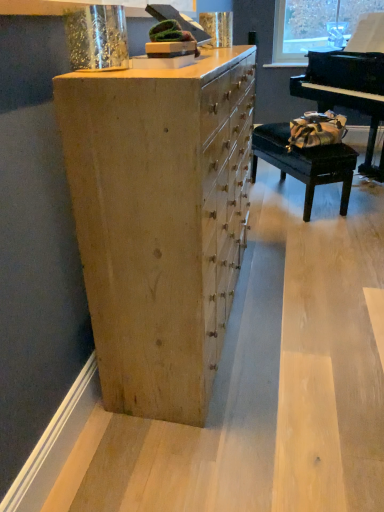
Locate an element on the screen. free space in front of natural wood chest of drawers at center is located at coordinates (250, 420).